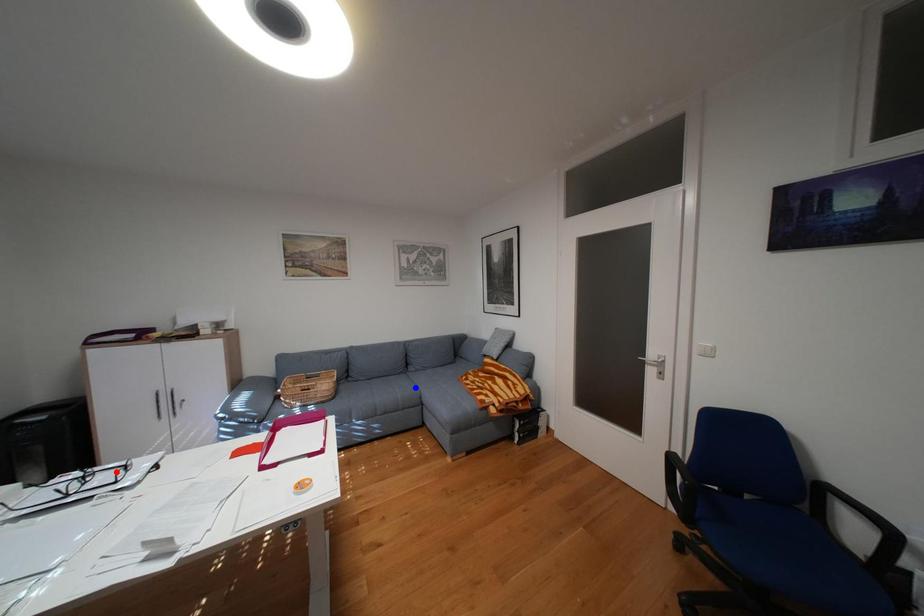
Question: Two points are marked on the image. Which point is closer to the camera?

Choices:
 (A) Blue point is closer.
 (B) Red point is closer.

Answer: (B)